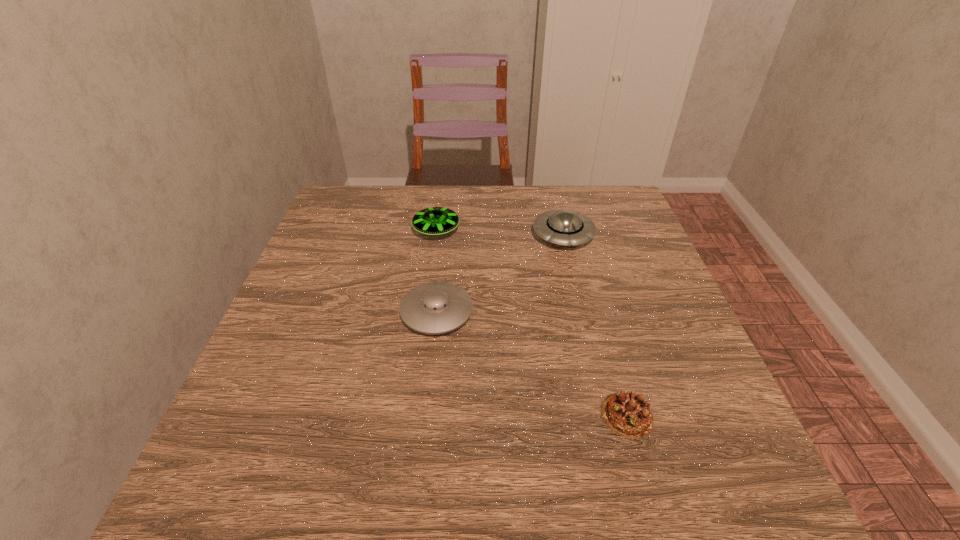
Where is `empty space that is in between the chocolate cake and the rightmost saucer`? The height and width of the screenshot is (540, 960). empty space that is in between the chocolate cake and the rightmost saucer is located at coordinates (595, 325).

Find the location of `free point between the shortest saucer and the rightmost saucer`. free point between the shortest saucer and the rightmost saucer is located at coordinates (500, 274).

What are the coordinates of `free space between the rightmost saucer and the nearest object` in the screenshot? It's located at (595, 325).

You are a GUI agent. You are given a task and a screenshot of the screen. Output one action in this format:
    pyautogui.click(x=<x>, y=<y>)
    Task: Click on the object that ranks as the closest to the nearest object
    This screenshot has height=540, width=960.
    Given the screenshot: What is the action you would take?
    pyautogui.click(x=438, y=307)

Identify which object is the nearest to the chocolate cake. Please provide its 2D coordinates. Your answer should be formatted as a tuple, i.e. [(x, y)], where the tuple contains the x and y coordinates of a point satisfying the conditions above.

[(438, 307)]

Locate an element on the screen. This screenshot has height=540, width=960. saucer that is the second closest one to the rightmost saucer is located at coordinates (438, 307).

Identify which saucer is the nearest to the second shortest object. Please provide its 2D coordinates. Your answer should be formatted as a tuple, i.e. [(x, y)], where the tuple contains the x and y coordinates of a point satisfying the conditions above.

[(433, 221)]

The width and height of the screenshot is (960, 540). Find the location of `free location that satisfies the following two spatial constraints: 1. on the back side of the rightmost saucer; 2. on the right side of the nearest saucer`. free location that satisfies the following two spatial constraints: 1. on the back side of the rightmost saucer; 2. on the right side of the nearest saucer is located at coordinates pyautogui.click(x=444, y=235).